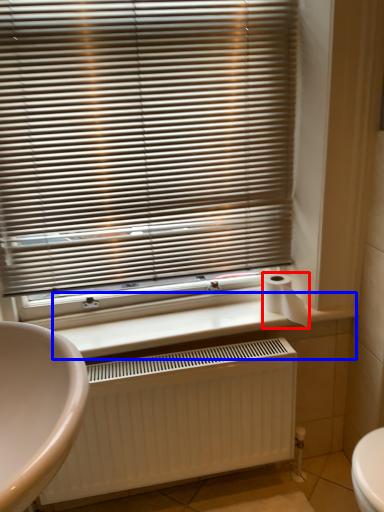
Question: Among these objects, which one is nearest to the camera, toilet paper (highlighted by a red box) or counter top (highlighted by a blue box)?

Choices:
 (A) toilet paper
 (B) counter top

Answer: (B)